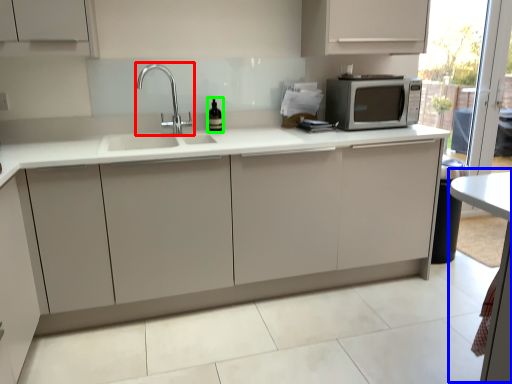
Question: Based on their relative distances, which object is farther from tap (highlighted by a red box)? Choose from table (highlighted by a blue box) and wine bottle (highlighted by a green box).

Choices:
 (A) table
 (B) wine bottle

Answer: (A)